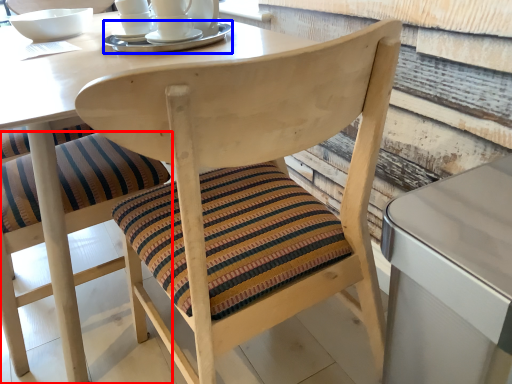
Question: Which object appears farthest to the camera in this image, chair (highlighted by a red box) or tableware (highlighted by a blue box)?

Choices:
 (A) chair
 (B) tableware

Answer: (B)